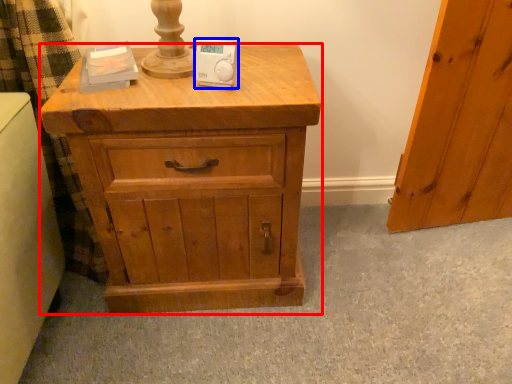
Question: Which of the following is the farthest to the observer, chest of drawers (highlighted by a red box) or ipod (highlighted by a blue box)?

Choices:
 (A) chest of drawers
 (B) ipod

Answer: (B)